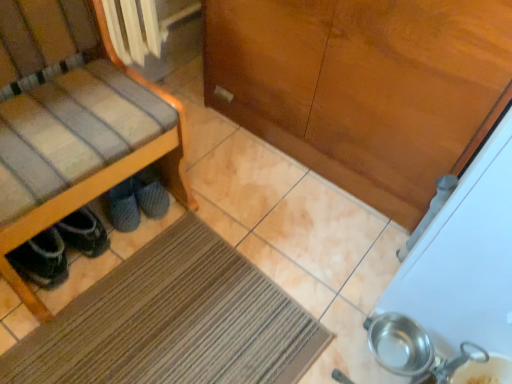
Question: Is wooden chair at left turned away from gray fuzzy slippers at lower left, which is counted as the 1th footwear, starting from the right?

Choices:
 (A) yes
 (B) no

Answer: (B)

Question: Are wooden chair at left and gray fuzzy slippers at lower left, which is the 2th footwear from front to back, located far from each other?

Choices:
 (A) no
 (B) yes

Answer: (A)

Question: Is wooden chair at left not within gray fuzzy slippers at lower left, which is the 2th footwear from front to back?

Choices:
 (A) yes
 (B) no

Answer: (A)

Question: Can you confirm if wooden chair at left is positioned to the right of gray fuzzy slippers at lower left, which is counted as the 1th footwear, starting from the right?

Choices:
 (A) no
 (B) yes

Answer: (A)

Question: Does wooden chair at left have a smaller size compared to gray fuzzy slippers at lower left, which is the 1th footwear in back-to-front order?

Choices:
 (A) yes
 (B) no

Answer: (B)

Question: From their relative heights in the image, would you say gray fuzzy slippers at lower left, which is the 1th footwear in back-to-front order, is taller or shorter than brown textured mat at lower center?

Choices:
 (A) short
 (B) tall

Answer: (B)

Question: Looking at the image, does gray fuzzy slippers at lower left, which is the 1th footwear in back-to-front order, seem bigger or smaller compared to brown textured mat at lower center?

Choices:
 (A) big
 (B) small

Answer: (B)

Question: From a real-world perspective, is gray fuzzy slippers at lower left, which is counted as the 1th footwear, starting from the right, above or below brown textured mat at lower center?

Choices:
 (A) below
 (B) above

Answer: (B)

Question: Relative to brown textured mat at lower center, is gray fuzzy slippers at lower left, which is counted as the 1th footwear, starting from the right, in front or behind?

Choices:
 (A) front
 (B) behind

Answer: (B)

Question: Does point (92, 240) appear closer or farther from the camera than point (254, 350)?

Choices:
 (A) farther
 (B) closer

Answer: (A)

Question: Considering their positions, is dark gray suede shoes under chair left, which ranks as the 2th footwear in right-to-left order, located in front of or behind brown textured mat at lower center?

Choices:
 (A) behind
 (B) front

Answer: (A)

Question: Based on their positions, is dark gray suede shoes under chair left, positioned as the first footwear in left-to-right order, located to the left or right of brown textured mat at lower center?

Choices:
 (A) left
 (B) right

Answer: (A)

Question: From a real-world perspective, relative to brown textured mat at lower center, is dark gray suede shoes under chair left, arranged as the first footwear when viewed from the front, vertically above or below?

Choices:
 (A) below
 (B) above

Answer: (B)

Question: Considering the positions of gray fuzzy slippers at lower left, which is the 2th footwear from left to right, and dark gray suede shoes under chair left, acting as the 2th footwear starting from the back, in the image, is gray fuzzy slippers at lower left, which is the 2th footwear from left to right, taller or shorter than dark gray suede shoes under chair left, acting as the 2th footwear starting from the back,?

Choices:
 (A) short
 (B) tall

Answer: (A)

Question: Is gray fuzzy slippers at lower left, which is the 2th footwear from left to right, inside the boundaries of dark gray suede shoes under chair left, arranged as the first footwear when viewed from the front, or outside?

Choices:
 (A) inside
 (B) outside

Answer: (B)